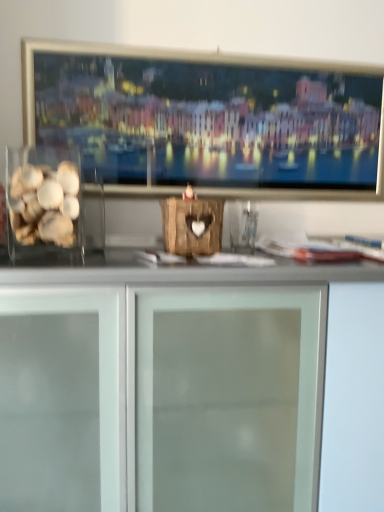
Identify the location of frosted glass cabinet at center. (164, 384).

What is the approximate width of frosted glass cabinet at center?

It is 16.49 inches.

Describe the element at coordinates (164, 384) in the screenshot. I see `frosted glass cabinet at center` at that location.

At what (x,y) coordinates should I click in order to perform the action: click on translucent glass shells at left. Please return your answer as a coordinate pair (x, y). Looking at the image, I should click on (45, 204).

What do you see at coordinates (45, 204) in the screenshot?
I see `translucent glass shells at left` at bounding box center [45, 204].

The width and height of the screenshot is (384, 512). In order to click on frosted glass cabinet at center in this screenshot , I will do `click(164, 384)`.

Which object is positioned more to the right, translucent glass shells at left or frosted glass cabinet at center?

Positioned to the right is frosted glass cabinet at center.

Is translucent glass shells at left positioned in front of frosted glass cabinet at center?

That is False.

Which is closer, (34, 185) or (223, 467)?

Point (34, 185) is farther from the camera than point (223, 467).

From the image's perspective, between translucent glass shells at left and frosted glass cabinet at center, which one is located above?

translucent glass shells at left appears higher in the image.

From a real-world perspective, which is physically below, translucent glass shells at left or frosted glass cabinet at center?

frosted glass cabinet at center is physically lower.

Does translucent glass shells at left have a lesser width compared to frosted glass cabinet at center?

Correct, the width of translucent glass shells at left is less than that of frosted glass cabinet at center.

Who is shorter, translucent glass shells at left or frosted glass cabinet at center?

Standing shorter between the two is translucent glass shells at left.

Based on the photo, considering the sizes of objects translucent glass shells at left and frosted glass cabinet at center in the image provided, who is bigger, translucent glass shells at left or frosted glass cabinet at center?

frosted glass cabinet at center.

Is translucent glass shells at left outside of frosted glass cabinet at center?

Yes.

Is translucent glass shells at left far from frosted glass cabinet at center?

No, there isn't a large distance between translucent glass shells at left and frosted glass cabinet at center.

Is frosted glass cabinet at center at the back of translucent glass shells at left?

No, translucent glass shells at left is not facing away from frosted glass cabinet at center.

Can you tell me how much translucent glass shells at left and frosted glass cabinet at center differ in facing direction?

The facing directions of translucent glass shells at left and frosted glass cabinet at center are 3.49 degrees apart.

Where is `food that is above the frosted glass cabinet at center (from the image's perspective)`? This screenshot has height=512, width=384. food that is above the frosted glass cabinet at center (from the image's perspective) is located at coordinates (45, 204).

Which is more to the right, frosted glass cabinet at center or translucent glass shells at left?

Positioned to the right is frosted glass cabinet at center.

Is frosted glass cabinet at center in front of or behind translucent glass shells at left in the image?

frosted glass cabinet at center is in front of translucent glass shells at left.

Between point (272, 430) and point (78, 176), which one is positioned in front?

The point (272, 430) is closer.

Based on the photo, from the image's perspective, which is above, frosted glass cabinet at center or translucent glass shells at left?

translucent glass shells at left is shown above in the image.

From a real-world perspective, relative to translucent glass shells at left, is frosted glass cabinet at center vertically above or below?

frosted glass cabinet at center is situated lower than translucent glass shells at left in the real world.

Can you confirm if frosted glass cabinet at center is thinner than translucent glass shells at left?

No, frosted glass cabinet at center is not thinner than translucent glass shells at left.

In the scene shown: Considering the sizes of objects frosted glass cabinet at center and translucent glass shells at left in the image provided, who is shorter, frosted glass cabinet at center or translucent glass shells at left?

translucent glass shells at left.

Can you confirm if frosted glass cabinet at center is bigger than translucent glass shells at left?

Yes.

Choose the correct answer: Is frosted glass cabinet at center inside translucent glass shells at left or outside it?

frosted glass cabinet at center is located beyond the bounds of translucent glass shells at left.

Are frosted glass cabinet at center and translucent glass shells at left located far from each other?

No, frosted glass cabinet at center is not far from translucent glass shells at left.

Could you tell me if frosted glass cabinet at center is turned towards translucent glass shells at left?

No.

I want to click on cabinetry to the right of translucent glass shells at left, so click(x=164, y=384).

The image size is (384, 512). I want to click on cabinetry that is under the translucent glass shells at left (from a real-world perspective), so (164, 384).

The image size is (384, 512). Identify the location of food above the frosted glass cabinet at center (from the image's perspective). (45, 204).